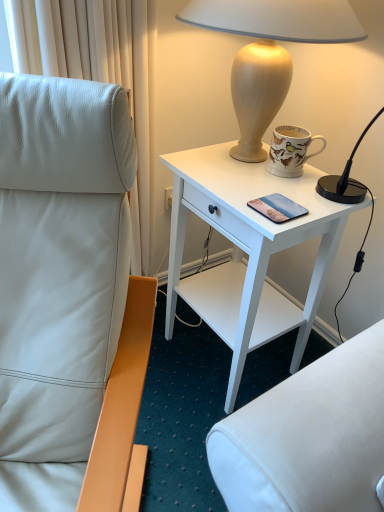
This screenshot has height=512, width=384. I want to click on vacant location below wooden lamp at upper right (from a real-world perspective), so pos(235,163).